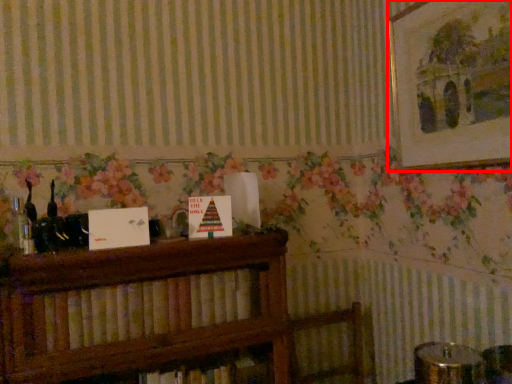
Question: From the image's perspective, where is picture frame (annotated by the red box) located relative to book?

Choices:
 (A) above
 (B) below

Answer: (A)